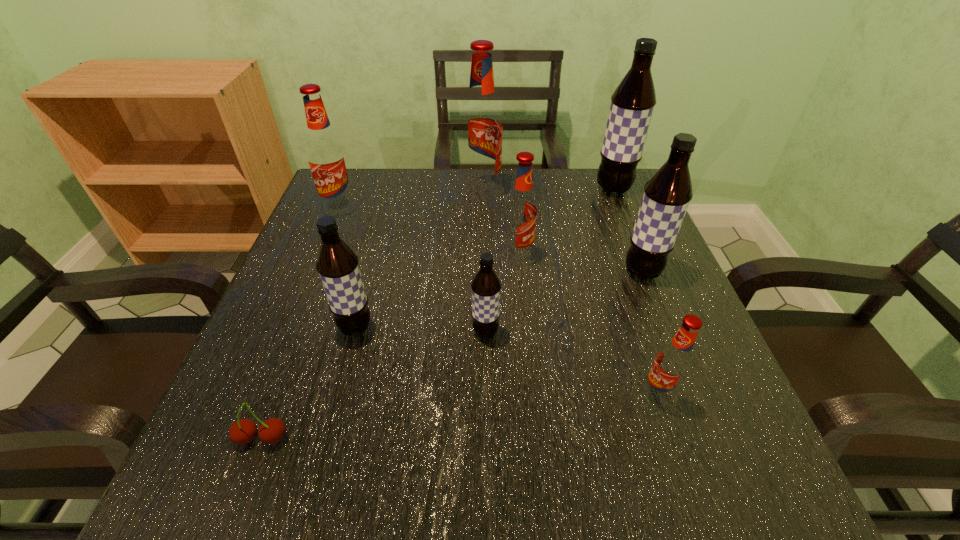
This screenshot has height=540, width=960. What are the coordinates of `vacant space situated on the left of the rightmost red root beer` in the screenshot? It's located at (406, 395).

Find the location of a particular element. The width and height of the screenshot is (960, 540). object situated at the near edge is located at coordinates click(x=271, y=431).

This screenshot has height=540, width=960. What are the coordinates of `cherry located in the left edge section of the desktop` in the screenshot? It's located at pyautogui.click(x=271, y=431).

Locate an element on the screen. Image resolution: width=960 pixels, height=540 pixels. object that is at the far left corner is located at coordinates (326, 156).

Find the location of a particular element. The height and width of the screenshot is (540, 960). object positioned at the near left corner is located at coordinates (271, 431).

Identify the location of object positioned at the far right corner. The height and width of the screenshot is (540, 960). (632, 103).

Locate an element on the screen. vacant space at the far edge of the desktop is located at coordinates (396, 201).

The height and width of the screenshot is (540, 960). I want to click on vacant area at the near edge of the desktop, so click(474, 478).

Locate an element on the screen. The width and height of the screenshot is (960, 540). vacant space at the right edge of the desktop is located at coordinates (619, 329).

Find the location of a particular element. The width and height of the screenshot is (960, 540). vacant space at the far left corner of the desktop is located at coordinates (364, 185).